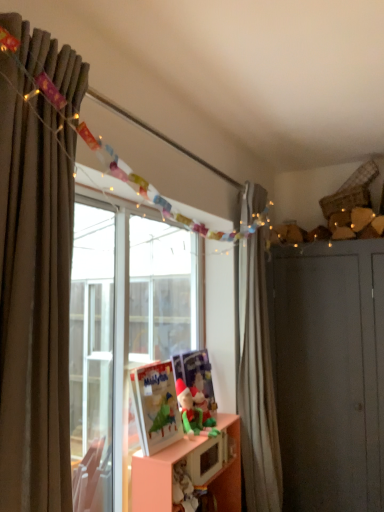
Question: Is brown fabric curtain at left, placed as the first curtain when sorted from front to back, thinner than green plush toy at lower center, which is counted as the 2th toy, starting from the front?

Choices:
 (A) no
 (B) yes

Answer: (A)

Question: Can green plush toy at lower center, which appears as the first toy when viewed from the back, be found inside brown fabric curtain at left, which is the 2th curtain in right-to-left order?

Choices:
 (A) no
 (B) yes

Answer: (A)

Question: Could you tell me if brown fabric curtain at left, which is the second curtain in back-to-front order, is facing green plush toy at lower center, which appears as the first toy when viewed from the back?

Choices:
 (A) no
 (B) yes

Answer: (A)

Question: From a real-world perspective, is brown fabric curtain at left, which is the second curtain in back-to-front order, positioned over green plush toy at lower center, which appears as the first toy when viewed from the back, based on gravity?

Choices:
 (A) yes
 (B) no

Answer: (A)

Question: Can you confirm if brown fabric curtain at left, which is the second curtain in back-to-front order, is shorter than green plush toy at lower center, which appears as the first toy when viewed from the back?

Choices:
 (A) yes
 (B) no

Answer: (B)

Question: Can you confirm if brown fabric curtain at left, which is the 2th curtain in right-to-left order, is smaller than green plush toy at lower center, which is counted as the 2th toy, starting from the front?

Choices:
 (A) no
 (B) yes

Answer: (A)

Question: Would you consider orange matte cabinet at center to be distant from white matte curtain at right, acting as the 2th curtain starting from the left?

Choices:
 (A) yes
 (B) no

Answer: (B)

Question: Does orange matte cabinet at center have a lesser width compared to white matte curtain at right, acting as the 2th curtain starting from the left?

Choices:
 (A) yes
 (B) no

Answer: (B)

Question: Considering the relative positions of orange matte cabinet at center and white matte curtain at right, acting as the 2th curtain starting from the left, in the image provided, is orange matte cabinet at center to the right of white matte curtain at right, acting as the 2th curtain starting from the left, from the viewer's perspective?

Choices:
 (A) yes
 (B) no

Answer: (B)

Question: Is orange matte cabinet at center turned away from white matte curtain at right, arranged as the second curtain when viewed from the front?

Choices:
 (A) yes
 (B) no

Answer: (B)

Question: Is orange matte cabinet at center wider than white matte curtain at right, acting as the 2th curtain starting from the left?

Choices:
 (A) yes
 (B) no

Answer: (A)

Question: Is white matte curtain at right, the first curtain positioned from the back, completely or partially inside orange matte cabinet at center?

Choices:
 (A) no
 (B) yes

Answer: (A)

Question: Could you tell me if green plush toy at lower center, which appears as the first toy when viewed from the back, is facing brown fabric curtain at left, which ranks as the first curtain in left-to-right order?

Choices:
 (A) no
 (B) yes

Answer: (A)